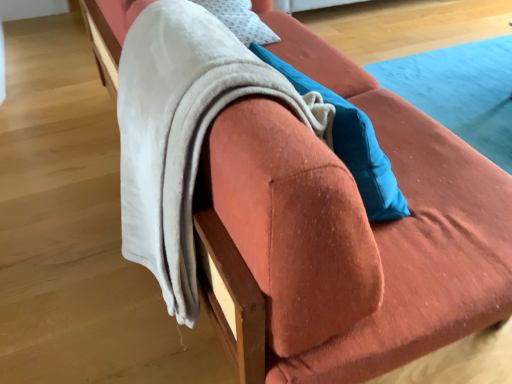
Question: In terms of height, does soft white fleece blanket at upper left look taller or shorter compared to white soft pillow at upper center?

Choices:
 (A) short
 (B) tall

Answer: (B)

Question: Looking at their shapes, would you say soft white fleece blanket at upper left is wider or thinner than white soft pillow at upper center?

Choices:
 (A) wide
 (B) thin

Answer: (A)

Question: In terms of size, does soft white fleece blanket at upper left appear bigger or smaller than white soft pillow at upper center?

Choices:
 (A) big
 (B) small

Answer: (A)

Question: Is white soft pillow at upper center in front of or behind soft white fleece blanket at upper left in the image?

Choices:
 (A) behind
 (B) front

Answer: (A)

Question: Does point coord(238,11) appear closer or farther from the camera than point coord(174,236)?

Choices:
 (A) closer
 (B) farther

Answer: (B)

Question: Based on their positions, is white soft pillow at upper center located to the left or right of soft white fleece blanket at upper left?

Choices:
 (A) right
 (B) left

Answer: (A)

Question: From the image's perspective, is white soft pillow at upper center positioned above or below soft white fleece blanket at upper left?

Choices:
 (A) below
 (B) above

Answer: (B)